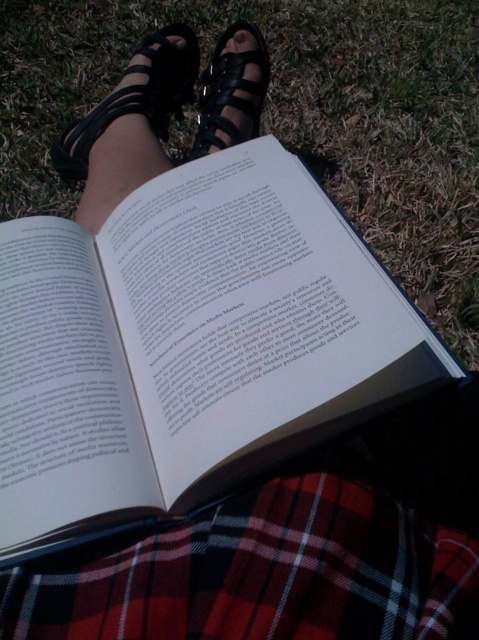
Question: Which of these objects is positioned farthest from the red plaid skirt at lower center?

Choices:
 (A) white paper book at center
 (B) green grass at center
 (C) black leather sandal at center

Answer: (B)

Question: Which object is the closest to the green grass at center?

Choices:
 (A) white paper book at center
 (B) red plaid skirt at lower center
 (C) black leather sandal at upper left
 (D) black leather sandal at center

Answer: (C)

Question: Where is green grass at center located in relation to black leather sandal at center in the image?

Choices:
 (A) above
 (B) below

Answer: (B)

Question: Which of the following is the farthest from the observer?

Choices:
 (A) (246, 116)
 (B) (423, 627)
 (C) (411, 152)
 (D) (196, 394)

Answer: (C)

Question: Observing the image, what is the correct spatial positioning of green grass at center in reference to black leather sandal at center?

Choices:
 (A) left
 (B) right

Answer: (B)

Question: Can you confirm if white paper book at center is wider than red plaid skirt at lower center?

Choices:
 (A) no
 (B) yes

Answer: (B)